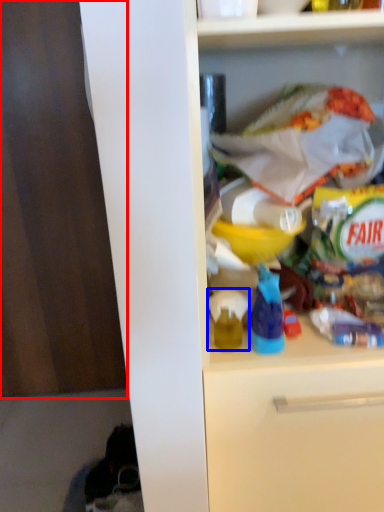
Question: Which object is further to the camera taking this photo, leftover (highlighted by a red box) or toy (highlighted by a blue box)?

Choices:
 (A) leftover
 (B) toy

Answer: (A)